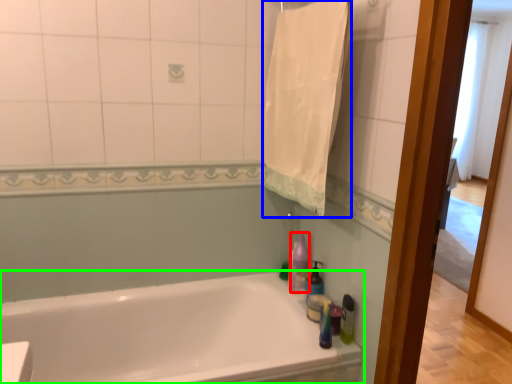
Question: Which is farther away from cleaning product (highlighted by a red box)? bath towel (highlighted by a blue box) or bathtub (highlighted by a green box)?

Choices:
 (A) bath towel
 (B) bathtub

Answer: (A)